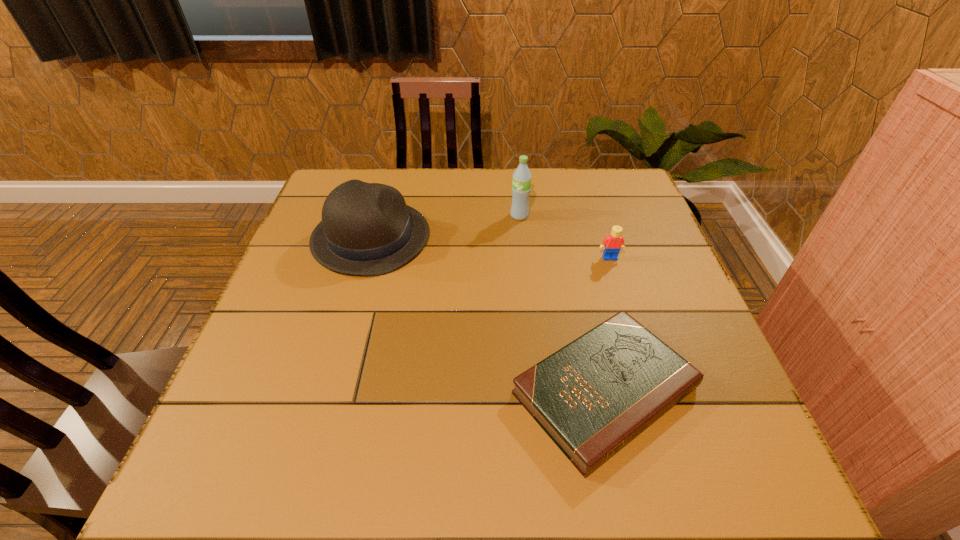
Image resolution: width=960 pixels, height=540 pixels. I want to click on water bottle, so click(x=521, y=185).

Image resolution: width=960 pixels, height=540 pixels. What are the coordinates of `the leftmost object` in the screenshot? It's located at (367, 229).

Identify the location of bowler hat. This screenshot has height=540, width=960. (367, 229).

Locate an element on the screen. This screenshot has height=540, width=960. the third tallest object is located at coordinates (614, 242).

Where is `the shortest object`? Image resolution: width=960 pixels, height=540 pixels. the shortest object is located at coordinates (592, 397).

In order to click on Bible in this screenshot , I will do `click(592, 397)`.

You are a GUI agent. You are given a task and a screenshot of the screen. Output one action in this format:
    pyautogui.click(x=<x>, y=<y>)
    Task: Click on the vacant region located 0.140m on the front of the water bottle
    The image size is (960, 540).
    Given the screenshot: What is the action you would take?
    pyautogui.click(x=523, y=254)

Locate an element on the screen. free spot located on the front-facing side of the third shortest object is located at coordinates (561, 238).

I want to click on free location located 0.140m on the face of the second shortest object, so click(624, 302).

Where is `blank space located 0.320m on the left of the nearest object`? blank space located 0.320m on the left of the nearest object is located at coordinates (344, 391).